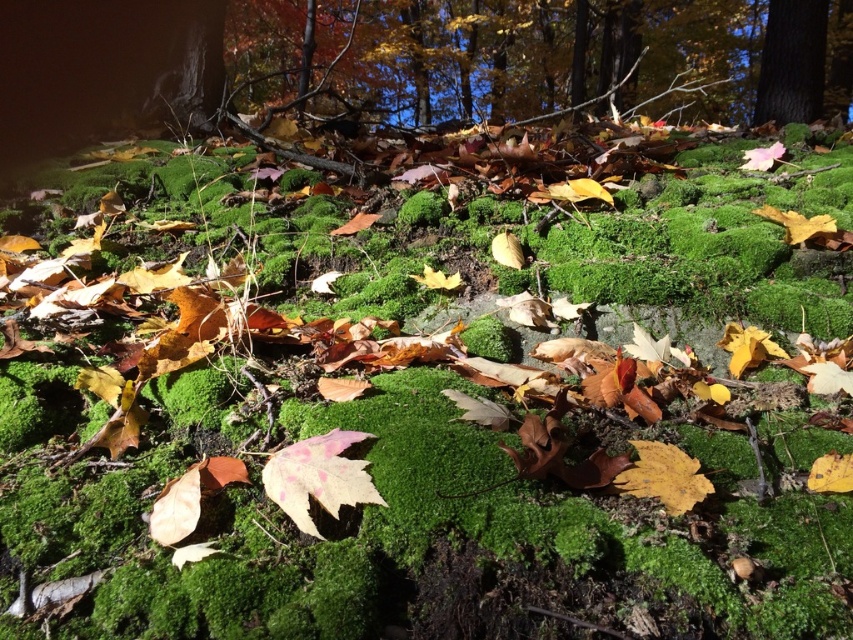
You are a photographer trying to capture a detailed shot of the autumn leaves at upper center and the smooth bark tree at upper right. Based on their sizes, which object would require a closer focus to ensure clarity in the photograph?

The autumn leaves at upper center might be wider than the smooth bark tree at upper right, so they would require closer focus to ensure clarity in the photograph.

You are a photographer planning to take a picture of the autumn leaves at upper center and the smooth bark tree at upper right. Based on their sizes in the image, which object would appear larger in the photo?

The autumn leaves at upper center would appear larger in the photo since they are taller than the smooth bark tree at upper right according to the description.